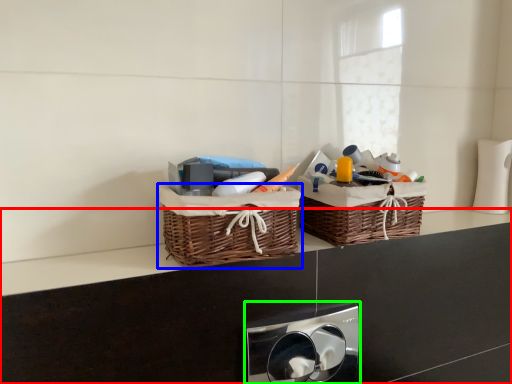
Question: Which object is positioned closest to counter (highlighted by a red box)? Select from picnic basket (highlighted by a blue box) and appliance (highlighted by a green box).

Choices:
 (A) picnic basket
 (B) appliance

Answer: (A)